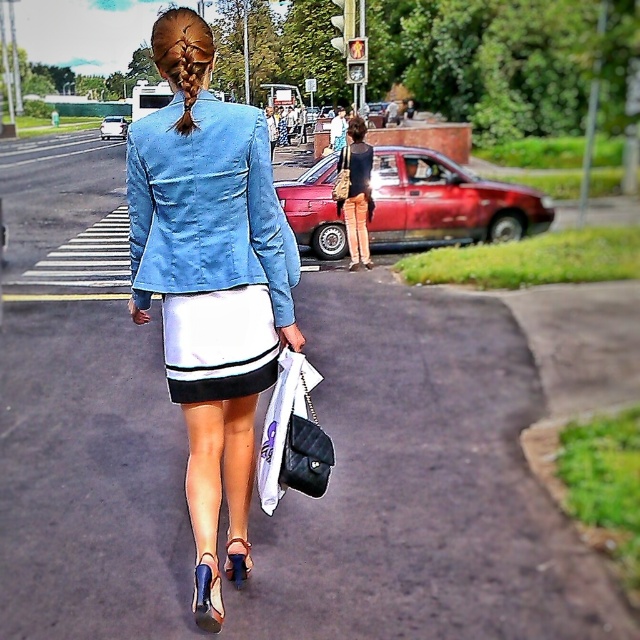
Question: Among these objects, which one is farthest from the camera?

Choices:
 (A) golden braided hair at upper center
 (B) metallic red car at center
 (C) metallic silver car at center

Answer: (C)

Question: Considering the real-world distances, which object is closest to the matte black tank top at center?

Choices:
 (A) metallic silver car at center
 (B) denim jacket at center
 (C) black leather handbag at lower center
 (D) golden braided hair at upper center

Answer: (B)

Question: Is matte black tank top at center wider than metallic silver car at center?

Choices:
 (A) yes
 (B) no

Answer: (B)

Question: Which of the following is the farthest from the observer?

Choices:
 (A) (227, 250)
 (B) (108, 134)

Answer: (B)

Question: Is matte black tank top at center bigger than black leather handbag at center?

Choices:
 (A) yes
 (B) no

Answer: (A)

Question: Is white satin skirt at center bigger than metallic silver car at center?

Choices:
 (A) yes
 (B) no

Answer: (B)